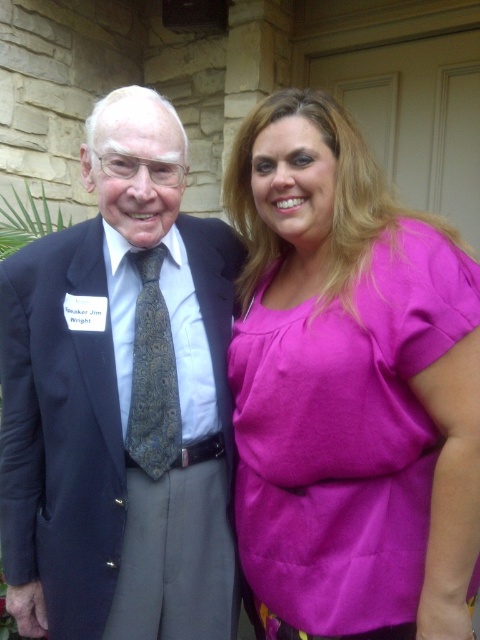
Question: Which point appears closest to the camera in this image?

Choices:
 (A) (155, 182)
 (B) (439, 403)

Answer: (B)

Question: Which point is farther from the camera taking this photo?

Choices:
 (A) (x=17, y=420)
 (B) (x=254, y=166)

Answer: (A)

Question: Is pink fabric blouse at right in front of dark gray paisley tie at center?

Choices:
 (A) yes
 (B) no

Answer: (A)

Question: Does pink fabric blouse at right come behind matte black suit at left?

Choices:
 (A) no
 (B) yes

Answer: (A)

Question: Which object appears closest to the camera in this image?

Choices:
 (A) dark gray paisley tie at center
 (B) matte black suit at left

Answer: (B)

Question: Can you confirm if pink fabric blouse at right is bigger than dark gray paisley tie at center?

Choices:
 (A) no
 (B) yes

Answer: (B)